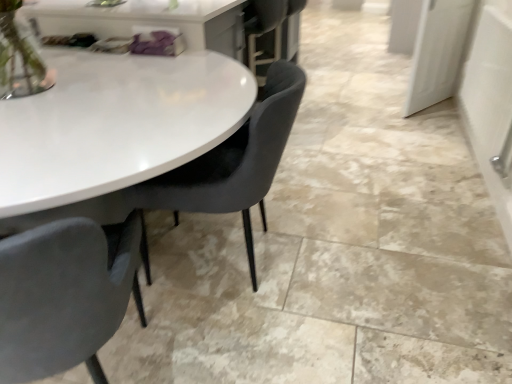
The width and height of the screenshot is (512, 384). Find the location of `free space in front of matte black chair at center, placed as the first chair when sorted from right to left`. free space in front of matte black chair at center, placed as the first chair when sorted from right to left is located at coordinates (248, 338).